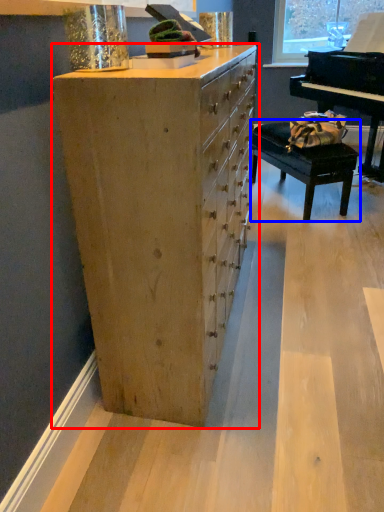
Question: Which of the following is the farthest to the observer, chest of drawers (highlighted by a red box) or table (highlighted by a blue box)?

Choices:
 (A) chest of drawers
 (B) table

Answer: (B)